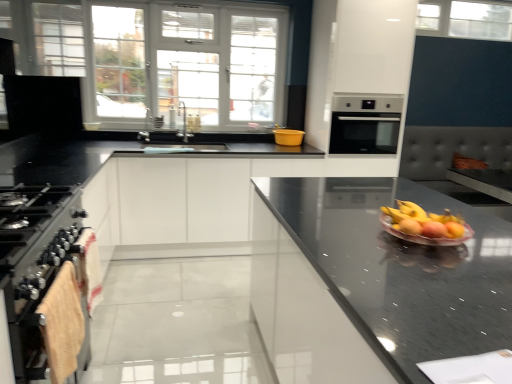
Question: Considering the positions of point (372, 114) and point (50, 322), is point (372, 114) closer or farther from the camera than point (50, 322)?

Choices:
 (A) closer
 (B) farther

Answer: (B)

Question: Considering the positions of satin silver oven at center and beige towel at lower left in the image, is satin silver oven at center taller or shorter than beige towel at lower left?

Choices:
 (A) short
 (B) tall

Answer: (B)

Question: Which of these objects is positioned farthest from the satin silver oven at center?

Choices:
 (A) white glass window at upper center, the first window positioned from the bottom
 (B) beige towel at lower left
 (C) yellow plastic bowl at center
 (D) clear glass window at upper center, marked as the 2th window in a bottom-to-top arrangement
 (E) shiny glass bowl of mixed fruits at center-right

Answer: (B)

Question: Which object is the closest to the stainless steel oven at left?

Choices:
 (A) yellow plastic bowl at center
 (B) white glass window at upper center, the second window in the right-to-left sequence
 (C) black glossy countertop at center
 (D) satin silver oven at center
 (E) clear glass window at upper center, marked as the 1th window in a right-to-left arrangement

Answer: (C)